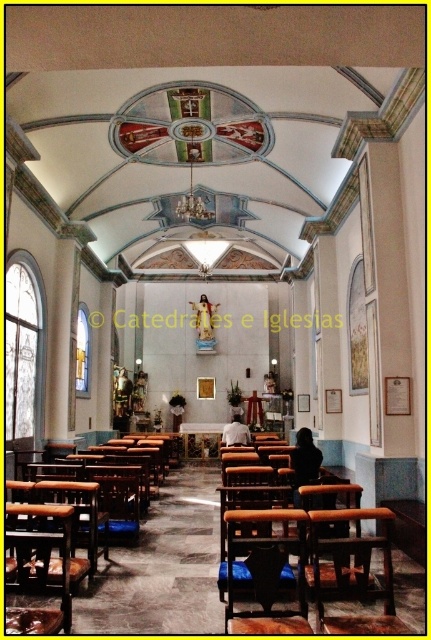
You are a photographer standing at the entrance of the church. You want to take a photo that includes both the gold textured statue at center and the white fabric shirt at center. Based on their positions, which object should appear closer to the camera in the photo?

The gold textured statue at center will appear closer to the camera because the white fabric shirt at center is behind it.